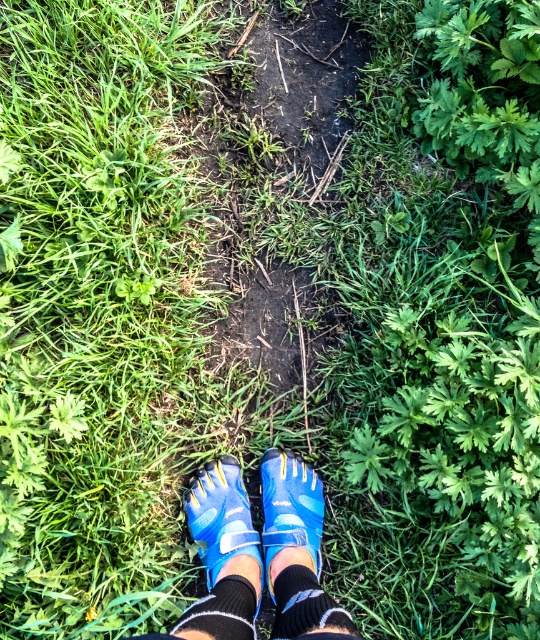
Can you confirm if blue synthetic shoe at lower center is positioned below black knit sock at lower center?

No, blue synthetic shoe at lower center is not below black knit sock at lower center.

Which is in front, point (240, 556) or point (239, 624)?

Point (239, 624)

Locate an element on the screen. blue synthetic shoe at lower center is located at coordinates (221, 518).

Find the location of `blue synthetic shoe at lower center`. blue synthetic shoe at lower center is located at coordinates (221, 518).

Between point (232, 460) and point (293, 467), which one is positioned in front?

Positioned in front is point (293, 467).

Is blue synthetic shoe at lower center taller than blue synthetic shoe at center?

Incorrect, blue synthetic shoe at lower center's height is not larger of blue synthetic shoe at center's.

Does point (202, 477) come behind point (280, 531)?

Yes, it is behind point (280, 531).

At what (x,y) coordinates should I click in order to perform the action: click on blue synthetic shoe at lower center. Please return your answer as a coordinate pair (x, y). Looking at the image, I should click on (221, 518).

Can you confirm if blue synthetic shoe at center is taller than black knitted sock at lower center?

Indeed, blue synthetic shoe at center has a greater height compared to black knitted sock at lower center.

Is point (294, 493) positioned after point (320, 627)?

Yes.

You are a GUI agent. You are given a task and a screenshot of the screen. Output one action in this format:
    pyautogui.click(x=<x>, y=<y>)
    Task: Click on the blue synthetic shoe at center
    
    Given the screenshot: What is the action you would take?
    pyautogui.click(x=289, y=508)